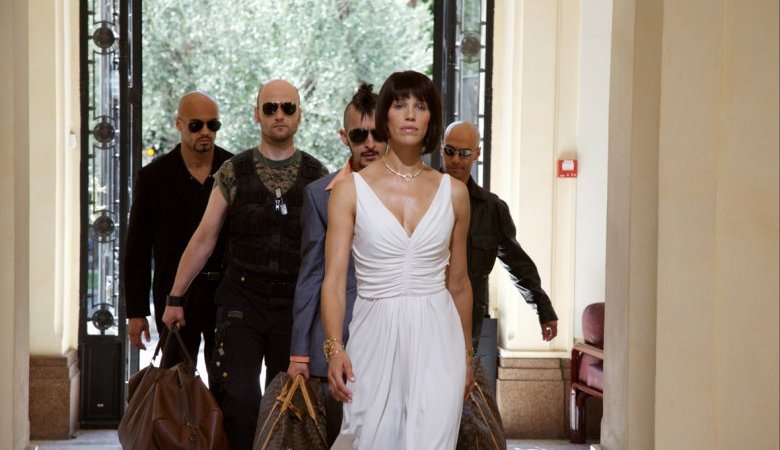
The width and height of the screenshot is (780, 450). Identify the location of fire alarm. (571, 167).